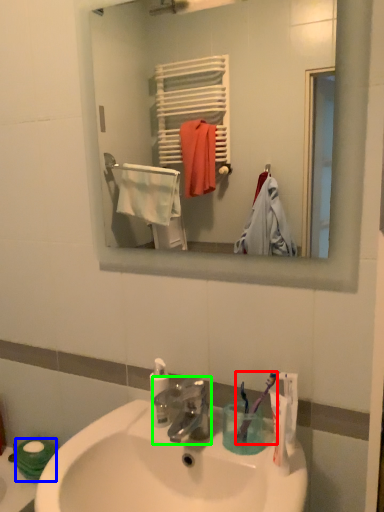
Question: Based on their relative distances, which object is farther from toothbrush (highlighted by a red box)? Choose from toilet paper (highlighted by a blue box) and tap (highlighted by a green box).

Choices:
 (A) toilet paper
 (B) tap

Answer: (A)